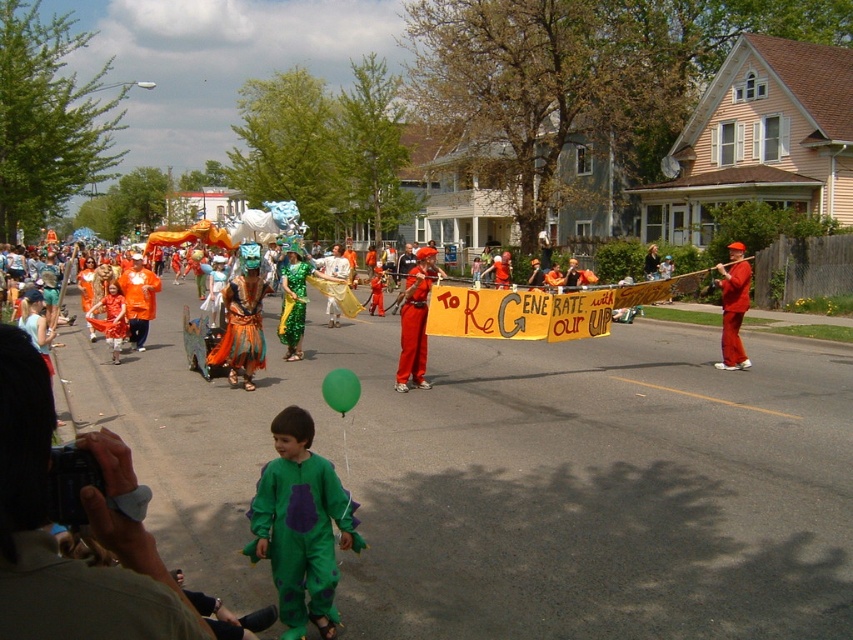
Question: Which point is closer to the camera taking this photo?

Choices:
 (A) (412, 285)
 (B) (322, 388)

Answer: (B)

Question: Considering the relative positions of shiny metallic armor at center and matte red uniform at center in the image provided, where is shiny metallic armor at center located with respect to matte red uniform at center?

Choices:
 (A) left
 (B) right

Answer: (A)

Question: Is green rubber balloon at center wider than shiny orange costume at center?

Choices:
 (A) yes
 (B) no

Answer: (B)

Question: Is matte red uniform at center smaller than green rubber balloon at center?

Choices:
 (A) no
 (B) yes

Answer: (A)

Question: Which of the following is the farthest from the observer?

Choices:
 (A) green rubber balloon at center
 (B) shiny orange costume at center
 (C) matte red uniform at center

Answer: (B)

Question: Which is farther from the matte red uniform at center?

Choices:
 (A) green shiny dragon at center
 (B) green matte jumpsuit at lower center
 (C) shiny red pants at center

Answer: (B)